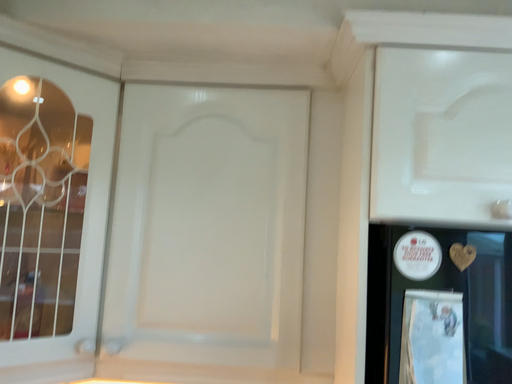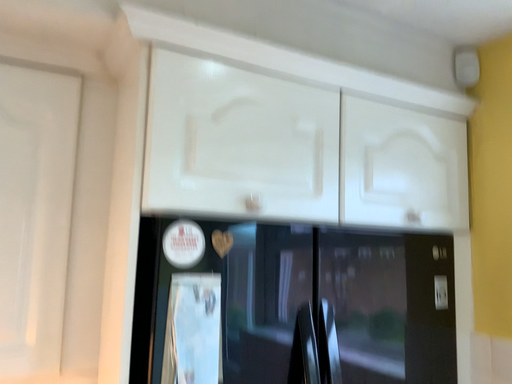
Question: How did the camera likely rotate when shooting the video?

Choices:
 (A) rotated left
 (B) rotated right

Answer: (B)